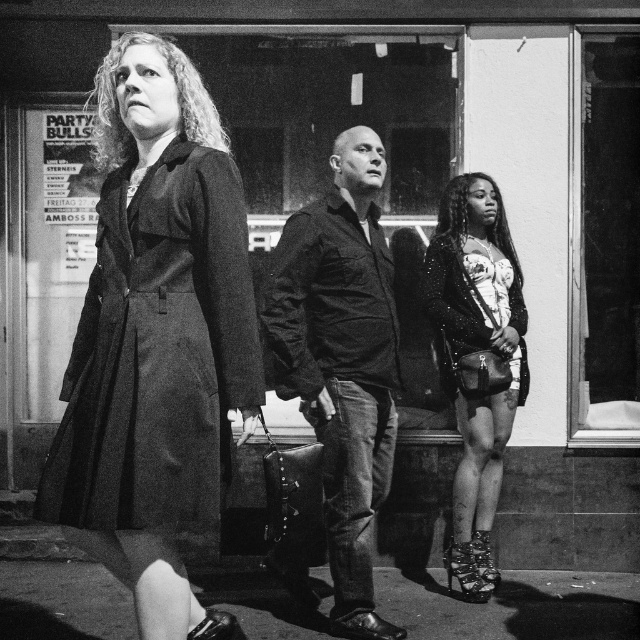
Question: Does transparent glass at right appear under shiny black pavement at lower center?

Choices:
 (A) yes
 (B) no

Answer: (B)

Question: Which object is farther from the camera taking this photo?

Choices:
 (A) leather jacket at center
 (B) matte black coat at center

Answer: (A)

Question: Is transparent glass at right further to the viewer compared to sparkly black dress at right?

Choices:
 (A) no
 (B) yes

Answer: (B)

Question: Does transparent glass at right lie behind sparkly black dress at right?

Choices:
 (A) yes
 (B) no

Answer: (A)

Question: Which object is positioned closest to the shiny black pavement at lower center?

Choices:
 (A) transparent glass at right
 (B) sparkly black dress at right
 (C) matte black coat at center
 (D) leather jacket at center

Answer: (D)

Question: Which point is closer to the camera taking this photo?

Choices:
 (A) (625, 237)
 (B) (396, 428)
 (C) (166, 256)

Answer: (C)